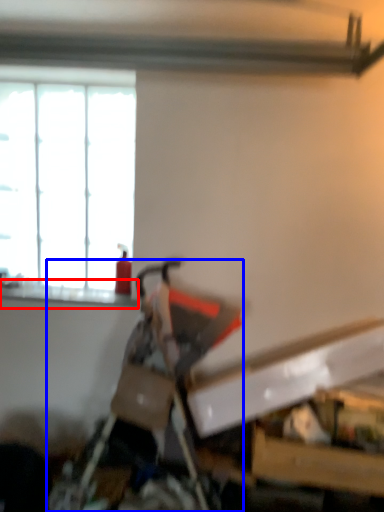
Question: Which of the following is the closest to the observer, window sill (highlighted by a red box) or swivel chair (highlighted by a blue box)?

Choices:
 (A) window sill
 (B) swivel chair

Answer: (B)